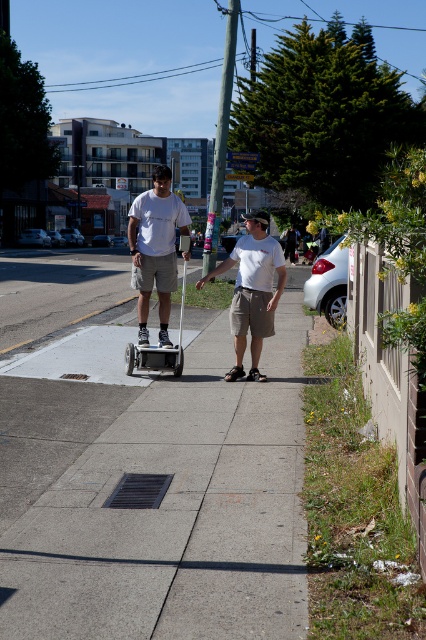
You are standing on the sidewalk and want to walk towards the grassy area. There are two points marked on the sidewalk. Which point, point (137, 620) or point (150, 273), is closer to you as you start walking towards the grassy area?

Point (137, 620) is closer to the viewer than point (150, 273), so it is closer as you start walking towards the grassy area.